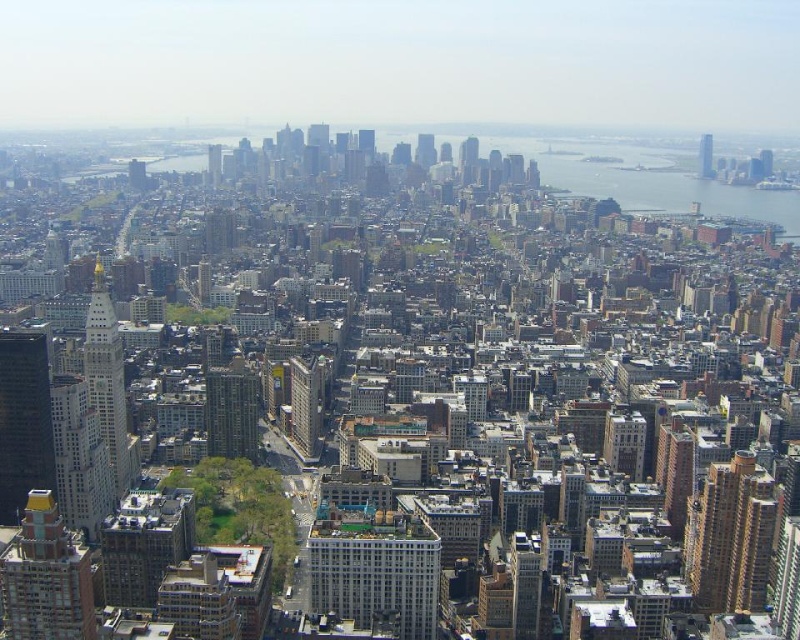
You are a city planner analyzing this urban area. You need to determine which of the two skyscrapers, the white glass skyscraper at left or the matte glass skyscraper at upper right, has a greater height. Based on the provided information, which one is taller?

The white glass skyscraper at left is much taller than the matte glass skyscraper at upper right, so it has a greater height.